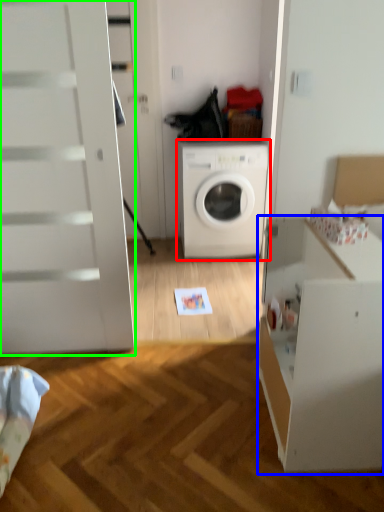
Question: Which object is the closest to the washing machine (highlighted by a red box)? Choose among these: file cabinet (highlighted by a blue box) or screen door (highlighted by a green box).

Choices:
 (A) file cabinet
 (B) screen door

Answer: (B)